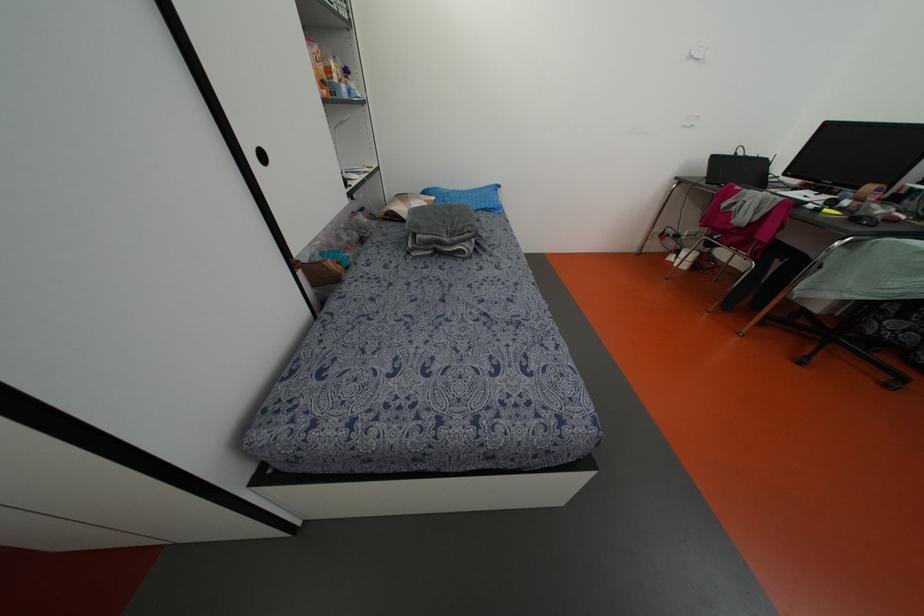
The image size is (924, 616). What do you see at coordinates (261, 156) in the screenshot? I see `the black recessed handle` at bounding box center [261, 156].